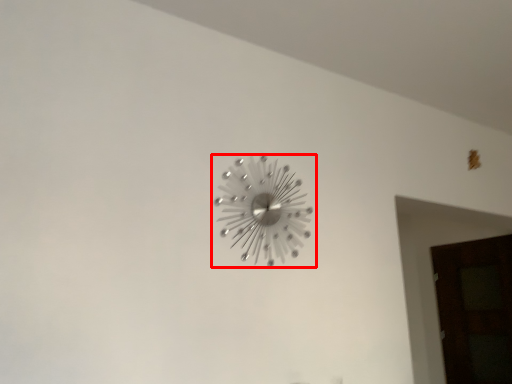
Question: From the image's perspective, where is wall clock (annotated by the red box) located in relation to door in the image?

Choices:
 (A) below
 (B) above

Answer: (B)